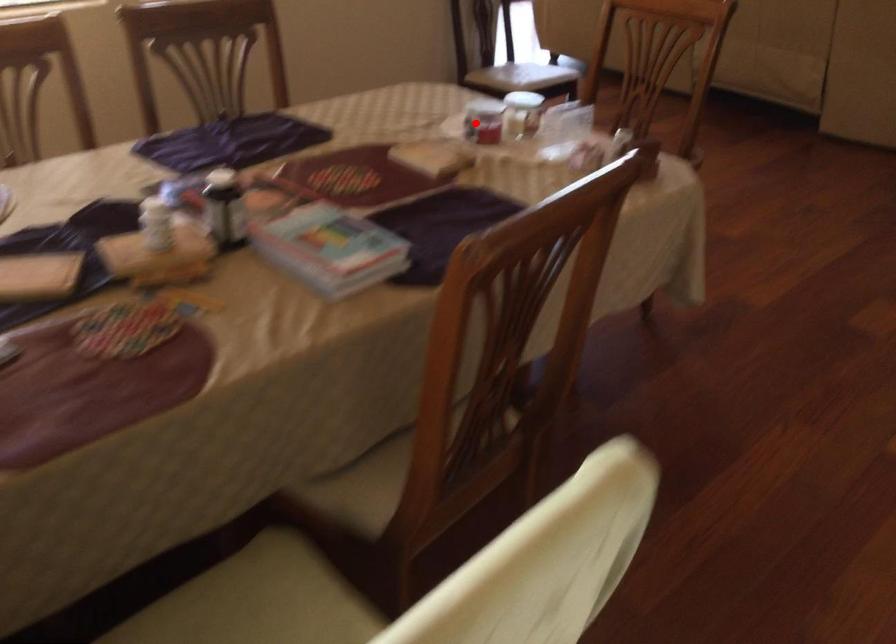
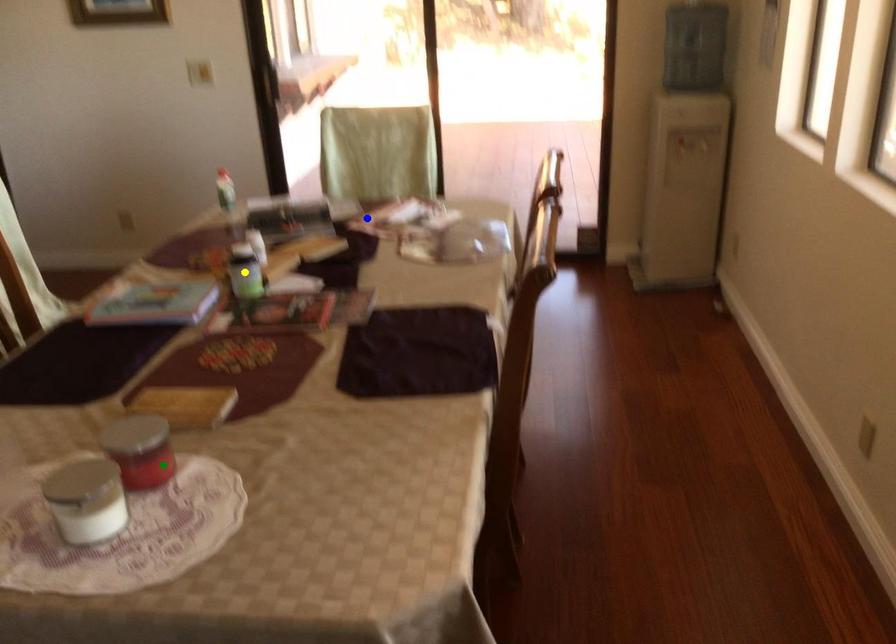
Question: I am providing you with two images of the same scene from different viewpoints. A red point is marked on the first image. You are given multiple points on the second image. Can you choose the point in image 2 that corresponds to the point in image 1?

Choices:
 (A) blue point
 (B) yellow point
 (C) green point

Answer: (C)